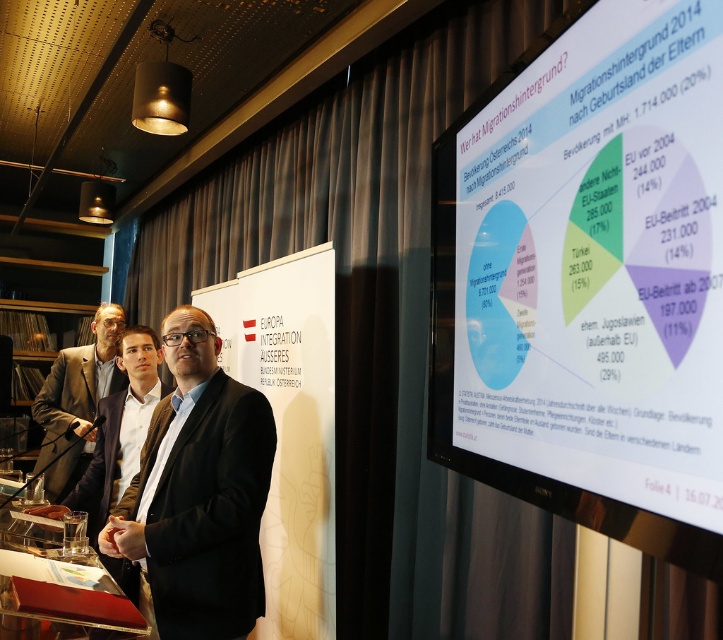
You are standing in the conference room and want to adjust the projector to ensure the white glossy projection screen at upper right is properly aligned. If the projector is placed 30 inches away from where you are standing, will you need to move it closer or farther away to match the required distance?

The white glossy projection screen at upper right and viewer are 28.86 inches apart. Since the projector is currently placed 30 inches away, which is farther than the required distance of 28.86 inches, you need to move it closer to achieve the correct alignment.

You are an event organizer who needs to arrange seating for the speakers. The black matte suit at center and the matte black suit at left are both present. Which speaker should you seat first if you want to follow the order of their positions in the image?

The matte black suit at left should be seated first since they are positioned higher in the image than the black matte suit at center, indicating they might be in a more prominent or earlier position.